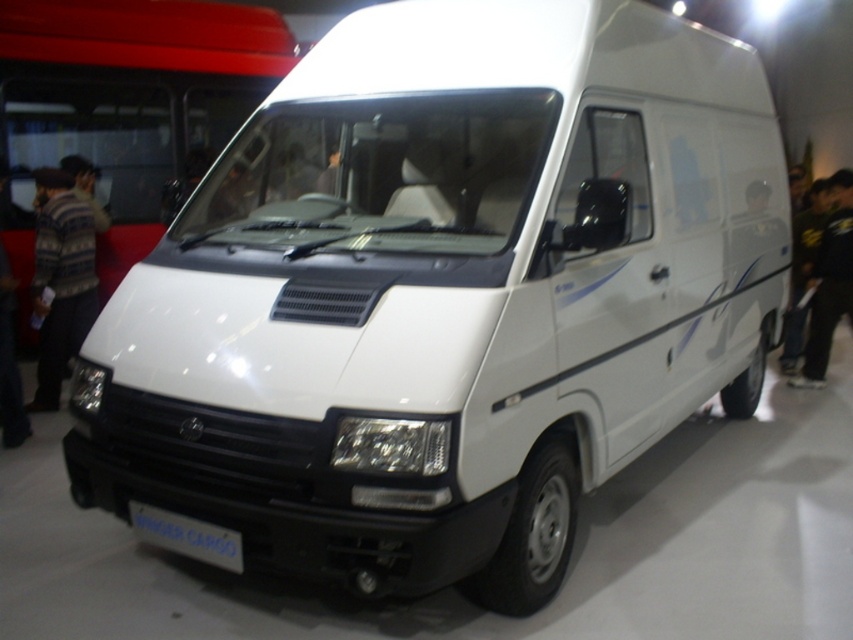
Question: Among these points, which one is farthest from the camera?

Choices:
 (A) (842, 266)
 (B) (51, 364)

Answer: (A)

Question: Which point is farther from the camera taking this photo?

Choices:
 (A) (838, 248)
 (B) (45, 220)

Answer: (A)

Question: In this image, where is striped sweater at left located relative to black fabric pants at right?

Choices:
 (A) above
 (B) below

Answer: (B)

Question: From the image, what is the correct spatial relationship of striped sweater at left in relation to black fabric pants at right?

Choices:
 (A) above
 (B) below

Answer: (B)

Question: Which object appears closest to the camera in this image?

Choices:
 (A) black fabric pants at right
 (B) striped sweater at left

Answer: (B)

Question: Is striped sweater at left in front of black fabric pants at right?

Choices:
 (A) yes
 (B) no

Answer: (A)